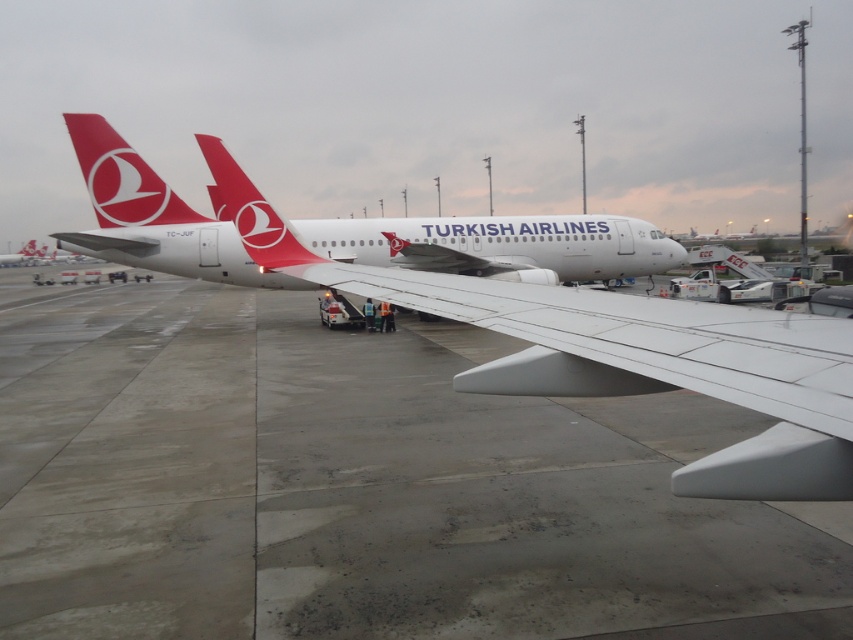
Who is lower down, concrete at center or matte red tail at upper center?

concrete at center is below.

Is concrete at center to the right of matte red tail at upper center from the viewer's perspective?

Indeed, concrete at center is positioned on the right side of matte red tail at upper center.

Between point (747, 412) and point (119, 196), which one is positioned behind?

Positioned behind is point (119, 196).

Locate an element on the screen. concrete at center is located at coordinates (363, 486).

How distant is white glossy airplane at center from matte red airplane tail at center?

white glossy airplane at center is 1.71 meters away from matte red airplane tail at center.

Does white glossy airplane at center have a lesser height compared to matte red airplane tail at center?

Yes, white glossy airplane at center is shorter than matte red airplane tail at center.

Locate an element on the screen. Image resolution: width=853 pixels, height=640 pixels. white glossy airplane at center is located at coordinates (616, 352).

Between point (433, 262) and point (111, 166), which one is positioned in front?

Point (111, 166)

What do you see at coordinates (500, 244) in the screenshot? This screenshot has height=640, width=853. I see `white matte airplane at center` at bounding box center [500, 244].

Locate an element on the screen. The width and height of the screenshot is (853, 640). white matte airplane at center is located at coordinates (500, 244).